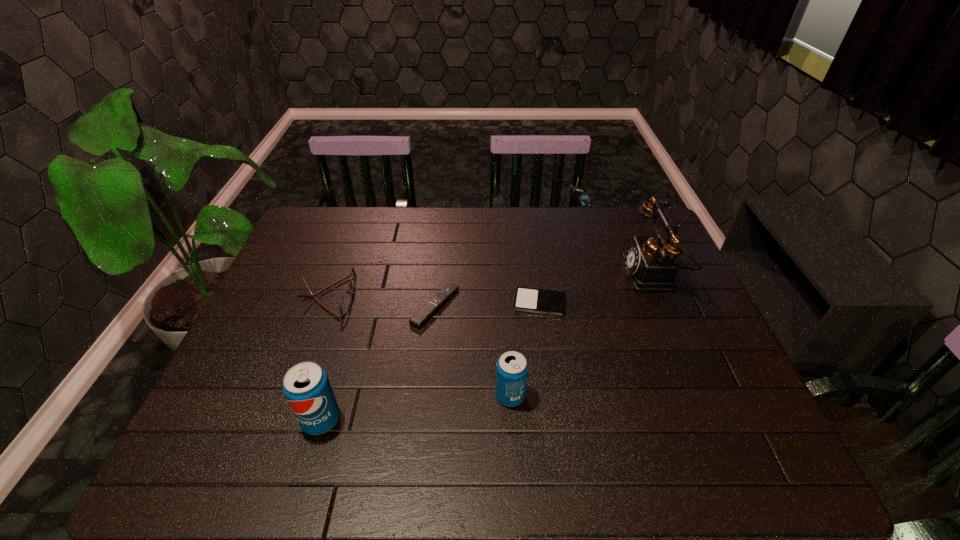
What are the coordinates of `the left soda can` in the screenshot? It's located at (306, 386).

At what (x,y) coordinates should I click in order to perform the action: click on the fifth shortest object. Please return your answer as a coordinate pair (x, y). Looking at the image, I should click on (306, 386).

Find the location of a particular element. The width and height of the screenshot is (960, 540). the right soda can is located at coordinates (512, 368).

In order to click on the fourth shortest object in this screenshot , I will do `click(512, 368)`.

Identify the location of spectacles. This screenshot has width=960, height=540. (346, 299).

This screenshot has height=540, width=960. Identify the location of the shortest object. (550, 302).

What are the coordinates of `the rightmost object` in the screenshot? It's located at (650, 262).

I want to click on the tallest object, so click(650, 262).

At what (x,y) coordinates should I click in order to perform the action: click on the fourth object from right to left. Please return your answer as a coordinate pair (x, y). This screenshot has width=960, height=540. Looking at the image, I should click on (427, 311).

The height and width of the screenshot is (540, 960). In order to click on remote control in this screenshot , I will do `click(427, 311)`.